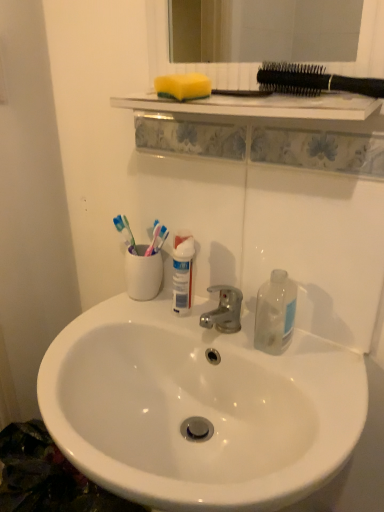
I want to click on vacant area that is in front of white ceramic toothbrush holder at center, so click(127, 324).